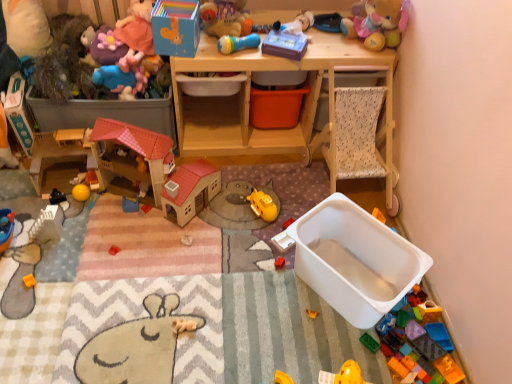
Question: From a real-world perspective, is yellow matte submarine at center, marked as the 9th toy in a left-to-right arrangement, physically located above or below purple plush toy at upper left, which is the third toy in left-to-right order?

Choices:
 (A) below
 (B) above

Answer: (A)

Question: Which is correct: yellow matte submarine at center, which appears as the fourth toy when viewed from the right, is inside purple plush toy at upper left, arranged as the tenth toy when viewed from the right, or outside of it?

Choices:
 (A) outside
 (B) inside

Answer: (A)

Question: Estimate the real-world distances between objects in this image. Which object is closer to the matte blue rubber duck at upper left, the 9th toy when ordered from right to left?

Choices:
 (A) white plastic toy at center, arranged as the tenth toy when viewed from the left
 (B) plastic toy car at upper left, which ranks as the 12th toy in right-to-left order
 (C) matte blue box at upper left, arranged as the seventh toy when viewed from the right
 (D) rubberized plastic microphone at upper center, which is the eighth toy from left to right
 (E) matte blue box at upper center, acting as the sixth toy starting from the right

Answer: (C)

Question: Which object is positioned farthest from the blue plastic toy at center, which ranks as the 8th toy in right-to-left order?

Choices:
 (A) translucent plastic car at lower right, placed as the 1th toy when sorted from right to left
 (B) soft plush toy at upper right, positioned as the second toy in right-to-left order
 (C) purple plush toy at upper left, which is the third toy in left-to-right order
 (D) rubberized plastic microphone at upper center, which is counted as the fifth toy, starting from the right
 (E) plastic toy car at upper left, acting as the 1th toy starting from the left

Answer: (B)